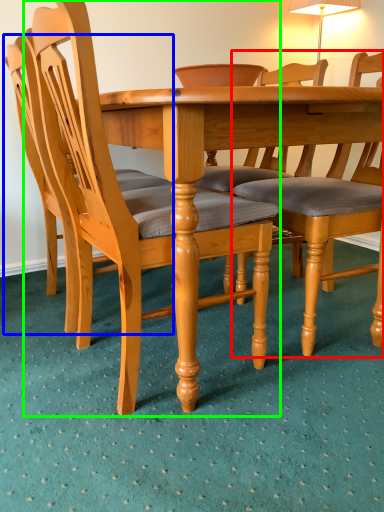
Question: Which object is positioned closest to chair (highlighted by a red box)? Select from chair (highlighted by a blue box) and chair (highlighted by a green box).

Choices:
 (A) chair
 (B) chair

Answer: (B)